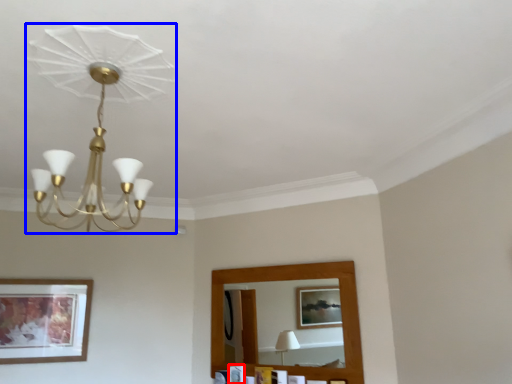
Question: Among these objects, which one is farthest to the camera, picture frame (highlighted by a red box) or lamp (highlighted by a blue box)?

Choices:
 (A) picture frame
 (B) lamp

Answer: (A)